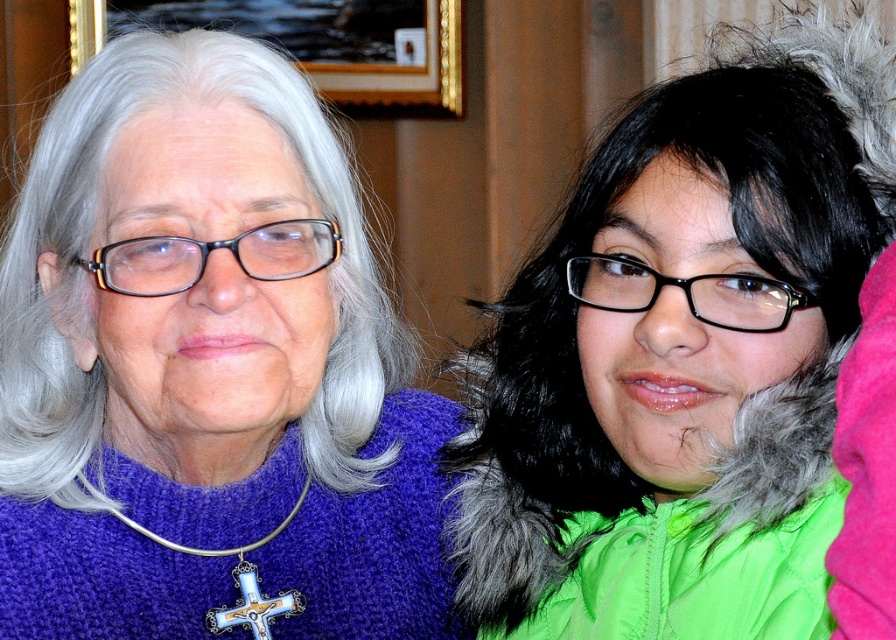
Does gold-framed picture at upper center have a lesser height compared to black acetate glasses at upper left?

No, gold-framed picture at upper center is not shorter than black acetate glasses at upper left.

Which is more to the right, gold-framed picture at upper center or black acetate glasses at upper left?

black acetate glasses at upper left

Is point (375, 61) positioned behind point (295, 234)?

Yes, point (375, 61) is farther from viewer.

You are a GUI agent. You are given a task and a screenshot of the screen. Output one action in this format:
    pyautogui.click(x=<x>, y=<y>)
    Task: Click on the gold-framed picture at upper center
    
    Given the screenshot: What is the action you would take?
    pyautogui.click(x=311, y=42)

Who is more forward, (444,80) or (748,298)?

Point (748,298) is in front.

Looking at this image, who is more distant from viewer, (319, 38) or (589, 300)?

Positioned behind is point (319, 38).

Image resolution: width=896 pixels, height=640 pixels. What are the coordinates of `gold-framed picture at upper center` in the screenshot? It's located at (311, 42).

Does green fuzzy coat at right have a greater width compared to black plastic glasses at center?

Correct, the width of green fuzzy coat at right exceeds that of black plastic glasses at center.

This screenshot has width=896, height=640. What do you see at coordinates (750, 257) in the screenshot?
I see `green fuzzy coat at right` at bounding box center [750, 257].

Where is `green fuzzy coat at right`? Image resolution: width=896 pixels, height=640 pixels. green fuzzy coat at right is located at coordinates (750, 257).